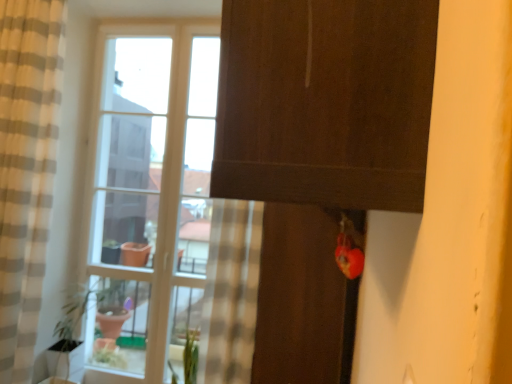
Question: Is the surface of clear glass window at center in direct contact with beige striped curtain at left?

Choices:
 (A) no
 (B) yes

Answer: (A)

Question: Is clear glass window at center shorter than beige striped curtain at left?

Choices:
 (A) no
 (B) yes

Answer: (A)

Question: Is clear glass window at center located outside beige striped curtain at left?

Choices:
 (A) yes
 (B) no

Answer: (A)

Question: Considering the relative sizes of clear glass window at center and beige striped curtain at left in the image provided, is clear glass window at center taller than beige striped curtain at left?

Choices:
 (A) no
 (B) yes

Answer: (B)

Question: From the image's perspective, is clear glass window at center under beige striped curtain at left?

Choices:
 (A) yes
 (B) no

Answer: (A)

Question: Considering the relative positions of clear glass window at center and beige striped curtain at left in the image provided, is clear glass window at center to the right of beige striped curtain at left from the viewer's perspective?

Choices:
 (A) yes
 (B) no

Answer: (A)

Question: Is the position of clear glass window at center more distant than that of clear glass vase at lower left?

Choices:
 (A) yes
 (B) no

Answer: (A)

Question: Can you confirm if clear glass window at center is positioned to the left of clear glass vase at lower left?

Choices:
 (A) yes
 (B) no

Answer: (B)

Question: From the image's perspective, does clear glass window at center appear higher than clear glass vase at lower left?

Choices:
 (A) yes
 (B) no

Answer: (A)

Question: Can you confirm if clear glass window at center is smaller than clear glass vase at lower left?

Choices:
 (A) yes
 (B) no

Answer: (B)

Question: Is clear glass window at center positioned in front of clear glass vase at lower left?

Choices:
 (A) yes
 (B) no

Answer: (B)

Question: Can you confirm if clear glass window at center is wider than clear glass vase at lower left?

Choices:
 (A) yes
 (B) no

Answer: (B)

Question: Is clear glass window at center in front of green matte plant at lower center?

Choices:
 (A) no
 (B) yes

Answer: (A)